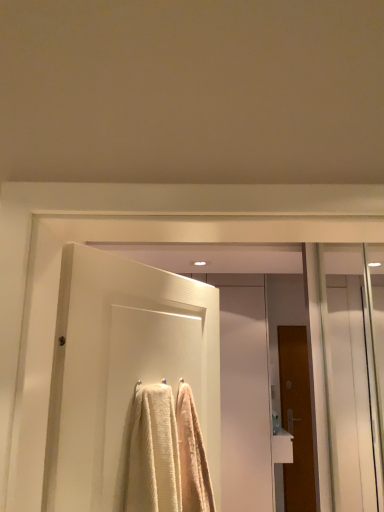
Locate an element on the screen. The height and width of the screenshot is (512, 384). white glossy sink at lower right is located at coordinates (x=281, y=443).

What do you see at coordinates (244, 394) in the screenshot? Image resolution: width=384 pixels, height=512 pixels. I see `white glossy door at center, which is the 1th screen door from back to front` at bounding box center [244, 394].

Where is `white glossy sink at lower right`? Image resolution: width=384 pixels, height=512 pixels. white glossy sink at lower right is located at coordinates (281, 443).

Can you confirm if white glossy sink at lower right is taller than brown wooden door at right, the 1th door when ordered from back to front?

Incorrect, the height of white glossy sink at lower right is not larger of that of brown wooden door at right, the 1th door when ordered from back to front.

From the picture: Is there a large distance between white glossy sink at lower right and brown wooden door at right, which appears as the second door when viewed from the front?

Actually, white glossy sink at lower right and brown wooden door at right, which appears as the second door when viewed from the front, are a little close together.

Is point (289, 441) farther from camera compared to point (297, 483)?

That is False.

How far apart are white glossy sink at lower right and brown wooden door at right, which appears as the 2th door when viewed from the left?

white glossy sink at lower right and brown wooden door at right, which appears as the 2th door when viewed from the left, are 22.15 inches apart from each other.

Looking at their sizes, would you say white glossy sink at lower right is wider or thinner than white textured door at center, which is the 1th door in left-to-right order?

Considering their sizes, white glossy sink at lower right looks broader than white textured door at center, which is the 1th door in left-to-right order.

From a real-world perspective, is white glossy sink at lower right over white textured door at center, the 1th door when ordered from top to bottom?

No, from a real-world perspective, white glossy sink at lower right is not over white textured door at center, the 1th door when ordered from top to bottom

Is white glossy sink at lower right oriented towards white textured door at center, the 2th door when ordered from back to front?

No, white glossy sink at lower right does not turn towards white textured door at center, the 2th door when ordered from back to front.

Which of these two, white glossy sink at lower right or white glossy door at center, which is the first screen door from left to right, stands shorter?

white glossy sink at lower right.

Is white glossy door at center, marked as the second screen door in a front-to-back arrangement, surrounded by white glossy sink at lower right?

Actually, white glossy door at center, marked as the second screen door in a front-to-back arrangement, is outside white glossy sink at lower right.

Which of these two, white glossy sink at lower right or white glossy door at center, marked as the second screen door in a front-to-back arrangement, is smaller?

With smaller size is white glossy sink at lower right.

Is white glossy sink at lower right aimed at white glossy door at center, the second screen door in the right-to-left sequence?

No, white glossy sink at lower right is not turned towards white glossy door at center, the second screen door in the right-to-left sequence.

Which screen door is the 1st one when counting from the left side of the white glossy sink at lower right? Please provide its 2D coordinates.

[(349, 394)]

Does transparent glass screen door at right, placed as the 1th screen door when sorted from right to left, turn towards white glossy sink at lower right?

No, transparent glass screen door at right, placed as the 1th screen door when sorted from right to left, does not turn towards white glossy sink at lower right.

Measure the distance from transparent glass screen door at right, placed as the 1th screen door when sorted from right to left, to white glossy sink at lower right.

transparent glass screen door at right, placed as the 1th screen door when sorted from right to left, and white glossy sink at lower right are 75.96 centimeters apart.

From the image's perspective, between transparent glass screen door at right, placed as the 1th screen door when sorted from right to left, and white glossy sink at lower right, who is located below?

white glossy sink at lower right is shown below in the image.

Are brown wooden door at right, which is counted as the 1th door, starting from the bottom, and transparent glass screen door at right, marked as the 1th screen door in a front-to-back arrangement, located far from each other?

No, brown wooden door at right, which is counted as the 1th door, starting from the bottom, is not far from transparent glass screen door at right, marked as the 1th screen door in a front-to-back arrangement.

In the scene shown: Considering the positions of objects brown wooden door at right, the second door positioned from the top, and transparent glass screen door at right, marked as the 2th screen door in a left-to-right arrangement, in the image provided, who is in front, brown wooden door at right, the second door positioned from the top, or transparent glass screen door at right, marked as the 2th screen door in a left-to-right arrangement,?

transparent glass screen door at right, marked as the 2th screen door in a left-to-right arrangement, is in front.

Considering the relative sizes of brown wooden door at right, which is counted as the 1th door, starting from the bottom, and transparent glass screen door at right, which is the second screen door from back to front, in the image provided, is brown wooden door at right, which is counted as the 1th door, starting from the bottom, wider than transparent glass screen door at right, which is the second screen door from back to front,?

No, brown wooden door at right, which is counted as the 1th door, starting from the bottom, is not wider than transparent glass screen door at right, which is the second screen door from back to front.

Considering the relative positions of white textured door at center, which is the 2th door in bottom-to-top order, and white glossy sink at lower right in the image provided, is white textured door at center, which is the 2th door in bottom-to-top order, to the right of white glossy sink at lower right from the viewer's perspective?

No, white textured door at center, which is the 2th door in bottom-to-top order, is not to the right of white glossy sink at lower right.

Who is bigger, white textured door at center, which is the 2th door in bottom-to-top order, or white glossy sink at lower right?

Bigger between the two is white textured door at center, which is the 2th door in bottom-to-top order.

From the image's perspective, does white textured door at center, the 2th door when ordered from back to front, appear lower than white glossy sink at lower right?

Incorrect, from the image's perspective, white textured door at center, the 2th door when ordered from back to front, is higher than white glossy sink at lower right.

Which object is thinner, white glossy sink at lower right or transparent glass screen door at right, placed as the 1th screen door when sorted from right to left?

transparent glass screen door at right, placed as the 1th screen door when sorted from right to left.

From the image's perspective, which is above, white glossy sink at lower right or transparent glass screen door at right, which is the second screen door from back to front?

transparent glass screen door at right, which is the second screen door from back to front.

Is transparent glass screen door at right, marked as the 1th screen door in a front-to-back arrangement, at the back of white glossy sink at lower right?

white glossy sink at lower right does not have its back to transparent glass screen door at right, marked as the 1th screen door in a front-to-back arrangement.

Can you confirm if white glossy sink at lower right is shorter than transparent glass screen door at right, which is the second screen door from back to front?

Yes.

You are a GUI agent. You are given a task and a screenshot of the screen. Output one action in this format:
    pyautogui.click(x=<x>, y=<y>)
    Task: Click on the 1st door above the white glossy sink at lower right (from the image's perspective)
    This screenshot has width=384, height=512.
    Given the screenshot: What is the action you would take?
    pyautogui.click(x=297, y=418)

The height and width of the screenshot is (512, 384). I want to click on sink behind the white textured door at center, the 1th door when ordered from top to bottom, so click(281, 443).

From the image, which object appears to be farther from white glossy door at center, which is the first screen door from left to right, white textured door at center, which is the 1th door in left-to-right order, or brown wooden door at right, which is counted as the 1th door, starting from the bottom?

Among the two, white textured door at center, which is the 1th door in left-to-right order, is located further to white glossy door at center, which is the first screen door from left to right.

Considering their positions, is transparent glass screen door at right, marked as the 1th screen door in a front-to-back arrangement, positioned closer to white glossy sink at lower right than brown wooden door at right, which appears as the second door when viewed from the front?

brown wooden door at right, which appears as the second door when viewed from the front.

From the picture: Which object lies further to the anchor point white glossy door at center, the second screen door in the right-to-left sequence, white textured door at center, which is counted as the second door, starting from the right, or transparent glass screen door at right, placed as the 1th screen door when sorted from right to left?

white textured door at center, which is counted as the second door, starting from the right, is positioned further to the anchor white glossy door at center, the second screen door in the right-to-left sequence.

Looking at the image, which one is located further to transparent glass screen door at right, which is the second screen door from back to front, white glossy sink at lower right or white textured door at center, which is the 1th door in left-to-right order?

Based on the image, white textured door at center, which is the 1th door in left-to-right order, appears to be further to transparent glass screen door at right, which is the second screen door from back to front.

Estimate the real-world distances between objects in this image. Which object is further from transparent glass screen door at right, marked as the 1th screen door in a front-to-back arrangement, white glossy sink at lower right or white glossy door at center, which is the 1th screen door from back to front?

Among the two, white glossy door at center, which is the 1th screen door from back to front, is located further to transparent glass screen door at right, marked as the 1th screen door in a front-to-back arrangement.

From the image, which object appears to be nearer to brown wooden door at right, which is counted as the 1th door, starting from the bottom, white glossy sink at lower right or white glossy door at center, which is the 1th screen door from back to front?

Based on the image, white glossy sink at lower right appears to be nearer to brown wooden door at right, which is counted as the 1th door, starting from the bottom.

Based on their spatial positions, is white glossy door at center, the second screen door in the right-to-left sequence, or white textured door at center, the first door viewed from the front, further from brown wooden door at right, the second door positioned from the top?

white textured door at center, the first door viewed from the front.

Considering their positions, is brown wooden door at right, which is the 1th door from right to left, positioned further to white textured door at center, the 1th door when ordered from top to bottom, than transparent glass screen door at right, which is the second screen door from back to front?

brown wooden door at right, which is the 1th door from right to left, lies further to white textured door at center, the 1th door when ordered from top to bottom, than the other object.

Where is `sink between white glossy door at center, the second screen door in the right-to-left sequence, and brown wooden door at right, which appears as the 2th door when viewed from the left, from left to right`? Image resolution: width=384 pixels, height=512 pixels. sink between white glossy door at center, the second screen door in the right-to-left sequence, and brown wooden door at right, which appears as the 2th door when viewed from the left, from left to right is located at coordinates (281, 443).

This screenshot has height=512, width=384. I want to click on screen door between transparent glass screen door at right, marked as the 1th screen door in a front-to-back arrangement, and white glossy sink at lower right in the front-back direction, so click(x=244, y=394).

Identify the location of screen door between white textured door at center, the 2th door when ordered from back to front, and white glossy door at center, which is the 1th screen door from back to front, in the front-back direction. This screenshot has width=384, height=512. (349, 394).

Where is `screen door between transparent glass screen door at right, placed as the 1th screen door when sorted from right to left, and brown wooden door at right, which is the 1th door from right to left, along the z-axis`? This screenshot has width=384, height=512. screen door between transparent glass screen door at right, placed as the 1th screen door when sorted from right to left, and brown wooden door at right, which is the 1th door from right to left, along the z-axis is located at coordinates (244, 394).